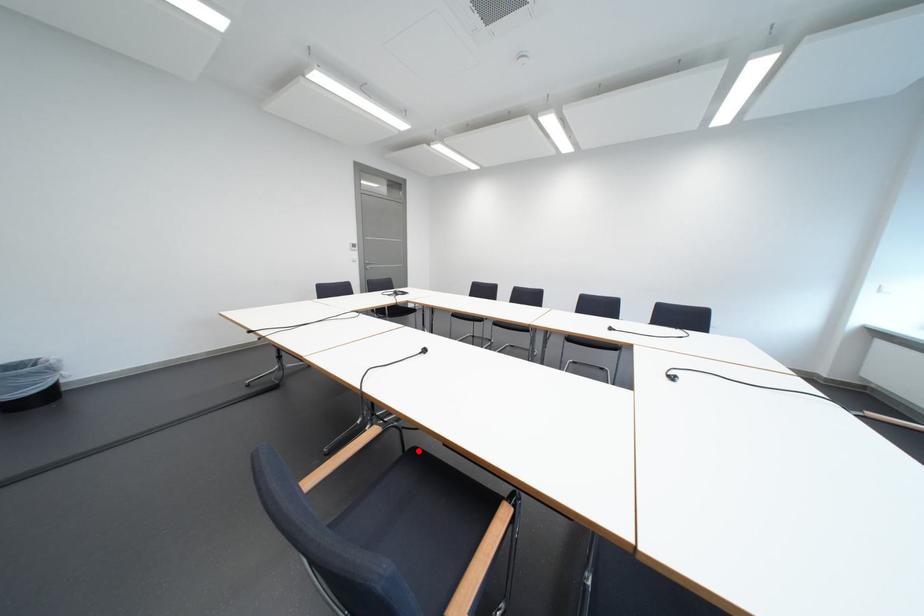
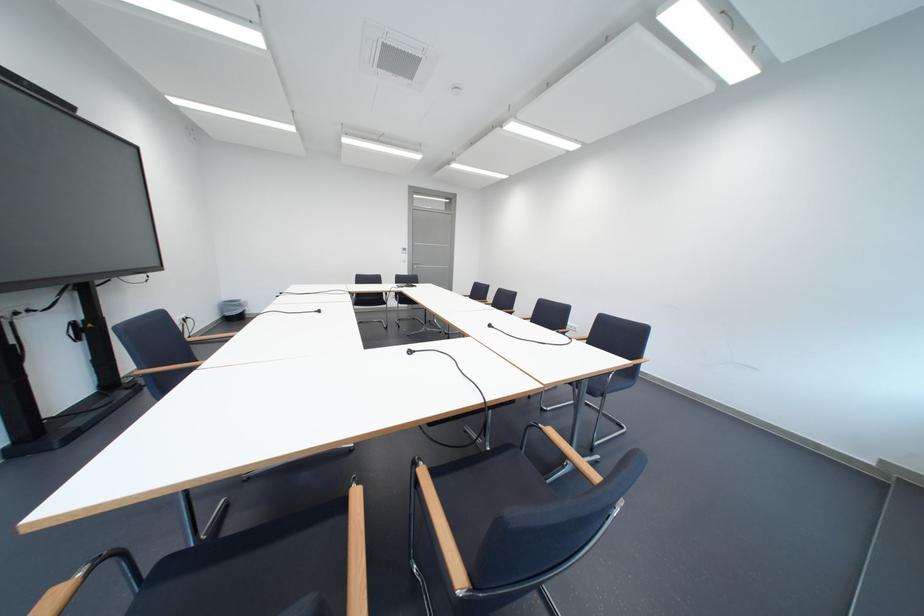
Question: I am providing you with two images of the same scene from different viewpoints. A red point is marked on the first image. Is the red point's position out of view in image 2?

Choices:
 (A) Yes
 (B) No

Answer: (A)